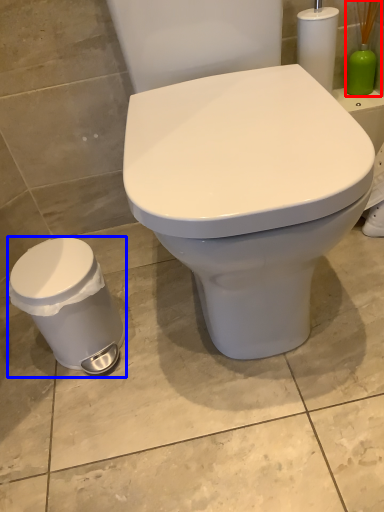
Question: Which point is closer to the camera, brush (highlighted by a red box) or porcelain (highlighted by a blue box)?

Choices:
 (A) brush
 (B) porcelain

Answer: (B)